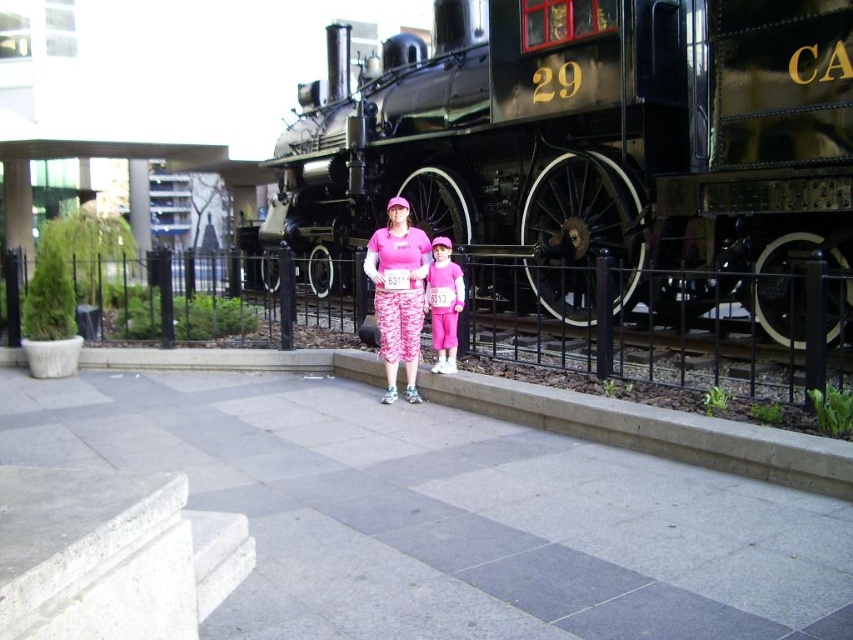
You are standing at the point labeled point (x=759, y=157) and want to take a photo of the locomotive 29 with your camera. The camera requires a minimum distance of 5 meters to focus properly. Will you be able to take a clear photo?

The point labeled point (x=759, y=157) and the camera are 6.63 meters apart, which is more than the required 5 meters. Therefore, you can take a clear photo.